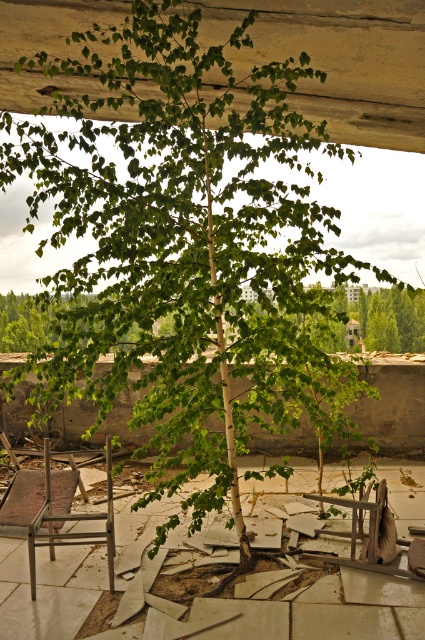
Question: Is green leafy tree at center above metallic silver chair at lower left?

Choices:
 (A) no
 (B) yes

Answer: (B)

Question: Which object appears farthest from the camera in this image?

Choices:
 (A) metallic silver chair at lower left
 (B) green leafy tree at center

Answer: (B)

Question: Observing the image, what is the correct spatial positioning of green leafy tree at center in reference to metallic silver chair at lower left?

Choices:
 (A) right
 (B) left

Answer: (B)

Question: Which point is farther to the camera?

Choices:
 (A) green leafy tree at center
 (B) metallic silver chair at lower left

Answer: (A)

Question: Can you confirm if green leafy tree at center is bigger than metallic silver chair at lower left?

Choices:
 (A) no
 (B) yes

Answer: (A)